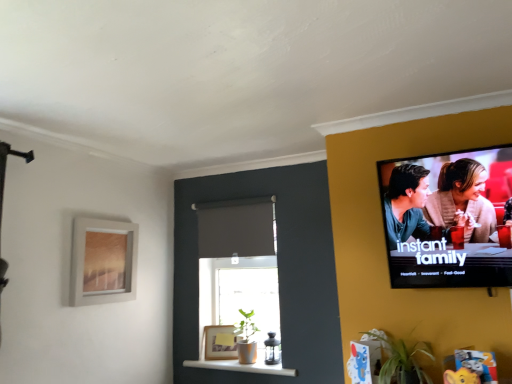
What do you see at coordinates (402, 360) in the screenshot? I see `green leafy plant at lower right` at bounding box center [402, 360].

The width and height of the screenshot is (512, 384). What do you see at coordinates (446, 219) in the screenshot?
I see `matte black tv at upper right` at bounding box center [446, 219].

Find the location of `matte gold picture frame at lower center, the second picture frame when ordered from top to bottom`. matte gold picture frame at lower center, the second picture frame when ordered from top to bottom is located at coordinates (220, 342).

How different are the orientations of matte gold picture frame at lower center, marked as the first picture frame in a bottom-to-top arrangement, and matte black tv at upper right in degrees?

There is a 30.4-degree angle between the facing directions of matte gold picture frame at lower center, marked as the first picture frame in a bottom-to-top arrangement, and matte black tv at upper right.

Does matte gold picture frame at lower center, which is the second picture frame from front to back, have a smaller size compared to matte black tv at upper right?

Yes.

Considering their positions, is matte gold picture frame at lower center, the first picture frame viewed from the right, located in front of or behind matte black tv at upper right?

matte gold picture frame at lower center, the first picture frame viewed from the right, is behind matte black tv at upper right.

Would you consider matte gold picture frame at lower center, the second picture frame when ordered from top to bottom, to be distant from matte black tv at upper right?

matte gold picture frame at lower center, the second picture frame when ordered from top to bottom, is far away from matte black tv at upper right.

Is matte black tv at upper right surrounding white glossy shelf at lower center?

No, matte black tv at upper right does not contain white glossy shelf at lower center.

Are matte black tv at upper right and white glossy shelf at lower center beside each other?

matte black tv at upper right is not next to white glossy shelf at lower center, and they're not touching.

From a real-world perspective, is matte black tv at upper right positioned over white glossy shelf at lower center based on gravity?

Yes, from a real-world perspective, matte black tv at upper right is over white glossy shelf at lower center

Which point is more forward, (482, 207) or (213, 365)?

The point (482, 207) is closer.

Is white glossy shelf at lower center spatially inside matte black tv at upper right, or outside of it?

white glossy shelf at lower center is not enclosed by matte black tv at upper right.

Which is closer to the camera, (228, 366) or (391, 165)?

Point (228, 366) is farther from the camera than point (391, 165).

Is white glossy shelf at lower center far from matte black tv at upper right?

white glossy shelf at lower center is positioned a significant distance from matte black tv at upper right.

Does white glossy shelf at lower center have a greater height compared to matte black tv at upper right?

No.

Is matte gray curtain at center not near white glossy shelf at lower center?

That's not correct — matte gray curtain at center is a little close to white glossy shelf at lower center.

Considering the sizes of objects matte gray curtain at center and white glossy shelf at lower center in the image provided, who is taller, matte gray curtain at center or white glossy shelf at lower center?

matte gray curtain at center.

From the image's perspective, between matte gray curtain at center and white glossy shelf at lower center, which one is located above?

matte gray curtain at center.

Based on their positions, is matte gray curtain at center located to the left or right of white glossy shelf at lower center?

matte gray curtain at center is positioned on white glossy shelf at lower center's left side.

In the image, is white glossy shelf at lower center on the left side or the right side of green leafy plant at lower right?

white glossy shelf at lower center is positioned on green leafy plant at lower right's left side.

Could you tell me if white glossy shelf at lower center is facing green leafy plant at lower right?

No, white glossy shelf at lower center is not oriented towards green leafy plant at lower right.

Which object is closer to the camera, white glossy shelf at lower center or green leafy plant at lower right?

green leafy plant at lower right is in front.

Between matte black tv at upper right and matte gold picture frame at lower center, the second picture frame when ordered from top to bottom, which one appears on the left side from the viewer's perspective?

matte gold picture frame at lower center, the second picture frame when ordered from top to bottom, is more to the left.

Is matte black tv at upper right directly adjacent to matte gold picture frame at lower center, the first picture frame viewed from the right?

matte black tv at upper right and matte gold picture frame at lower center, the first picture frame viewed from the right, are clearly separated.

Consider the image. From the image's perspective, which is above, matte black tv at upper right or matte gold picture frame at lower center, the first picture frame viewed from the right?

matte black tv at upper right, from the image's perspective.

Is matte black tv at upper right not inside matte gold picture frame at lower center, arranged as the 2th picture frame when viewed from the left?

Absolutely, matte black tv at upper right is external to matte gold picture frame at lower center, arranged as the 2th picture frame when viewed from the left.

From the picture: Which point is more forward, (103, 298) or (229, 367)?

Point (103, 298)

Is matte silver picture frame at upper left, arranged as the 1th picture frame when viewed from the front, taller than white glossy shelf at lower center?

Correct, matte silver picture frame at upper left, arranged as the 1th picture frame when viewed from the front, is much taller as white glossy shelf at lower center.

Is matte silver picture frame at upper left, marked as the second picture frame in a bottom-to-top arrangement, positioned beyond the bounds of white glossy shelf at lower center?

Yes, matte silver picture frame at upper left, marked as the second picture frame in a bottom-to-top arrangement, is not within white glossy shelf at lower center.

Is matte silver picture frame at upper left, marked as the second picture frame in a bottom-to-top arrangement, looking in the opposite direction of white glossy shelf at lower center?

matte silver picture frame at upper left, marked as the second picture frame in a bottom-to-top arrangement, is not turned away from white glossy shelf at lower center.

Which picture frame is the 2nd one when counting from the back of the matte black tv at upper right? Please provide its 2D coordinates.

[(220, 342)]

The width and height of the screenshot is (512, 384). In order to click on window sill below the matte black tv at upper right (from a real-world perspective) in this screenshot , I will do `click(243, 366)`.

Looking at the image, which one is located further to matte gold picture frame at lower center, which is the second picture frame from front to back, matte black tv at upper right or white glossy shelf at lower center?

The object further to matte gold picture frame at lower center, which is the second picture frame from front to back, is matte black tv at upper right.

Based on their spatial positions, is white glossy shelf at lower center or matte gold picture frame at lower center, the first picture frame viewed from the right, closer to green leafy plant at lower right?

white glossy shelf at lower center is closer to green leafy plant at lower right.

From the image, which object appears to be farther from matte black tv at upper right, white glossy shelf at lower center or matte gold picture frame at lower center, marked as the first picture frame in a bottom-to-top arrangement?

matte gold picture frame at lower center, marked as the first picture frame in a bottom-to-top arrangement, is further to matte black tv at upper right.

Considering their positions, is matte black tv at upper right positioned closer to white glossy shelf at lower center than matte silver picture frame at upper left, which is the first picture frame in left-to-right order?

matte silver picture frame at upper left, which is the first picture frame in left-to-right order, is positioned closer to the anchor white glossy shelf at lower center.

Based on their spatial positions, is green leafy plant at lower right or matte black tv at upper right closer to matte gold picture frame at lower center, marked as the first picture frame in a bottom-to-top arrangement?

green leafy plant at lower right lies closer to matte gold picture frame at lower center, marked as the first picture frame in a bottom-to-top arrangement, than the other object.

When comparing their distances from matte black tv at upper right, does matte gray curtain at center or white glossy shelf at lower center seem further?

Among the two, white glossy shelf at lower center is located further to matte black tv at upper right.

Looking at the image, which one is located closer to matte gold picture frame at lower center, the second picture frame when ordered from top to bottom, white glossy shelf at lower center or matte silver picture frame at upper left, arranged as the 1th picture frame when viewed from the front?

white glossy shelf at lower center lies closer to matte gold picture frame at lower center, the second picture frame when ordered from top to bottom, than the other object.

When comparing their distances from matte black tv at upper right, does white glossy shelf at lower center or green leafy plant at lower right seem further?

white glossy shelf at lower center lies further to matte black tv at upper right than the other object.

Locate an element on the screen. This screenshot has width=512, height=384. window sill between matte silver picture frame at upper left, arranged as the 1th picture frame when viewed from the front, and green leafy plant at lower right from left to right is located at coordinates (243, 366).

The image size is (512, 384). Identify the location of window sill positioned between green leafy plant at lower right and matte gray curtain at center from near to far. (243, 366).

The height and width of the screenshot is (384, 512). Find the location of `window sill located between green leafy plant at lower right and matte gold picture frame at lower center, the second picture frame when ordered from top to bottom, in the depth direction`. window sill located between green leafy plant at lower right and matte gold picture frame at lower center, the second picture frame when ordered from top to bottom, in the depth direction is located at coordinates (243, 366).

At what (x,y) coordinates should I click in order to perform the action: click on picture frame between matte gray curtain at center and matte gold picture frame at lower center, the second picture frame when ordered from top to bottom, in the vertical direction. Please return your answer as a coordinate pair (x, y). The width and height of the screenshot is (512, 384). Looking at the image, I should click on (103, 261).